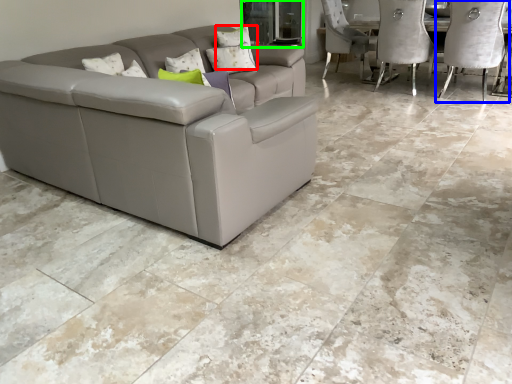
Question: Based on their relative distances, which object is farther from pillow (highlighted by a red box)? Choose from chair (highlighted by a blue box) and glass door (highlighted by a green box).

Choices:
 (A) chair
 (B) glass door

Answer: (A)